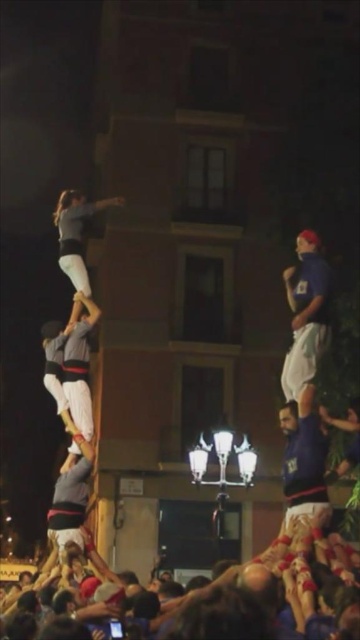
At what (x,y) coordinates should I click in order to perform the action: click on white cotton crowd at lower center. Please return your answer as a coordinate pair (x, y). Looking at the image, I should click on (272, 589).

The width and height of the screenshot is (360, 640). In order to click on white cotton crowd at lower center in this screenshot , I will do `click(272, 589)`.

At what (x,y) coordinates should I click in order to perform the action: click on white cotton crowd at lower center. Please return your answer as a coordinate pair (x, y). Looking at the image, I should click on (272, 589).